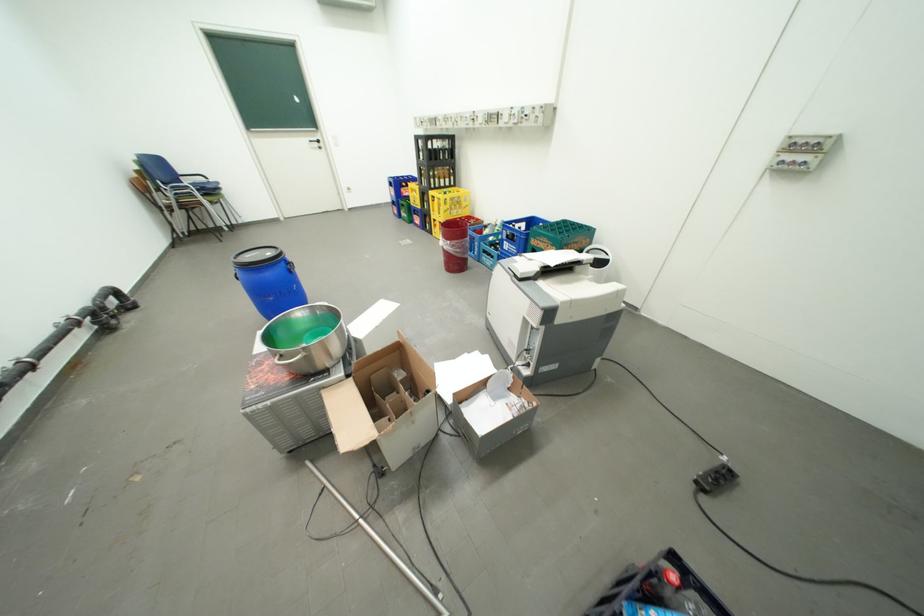
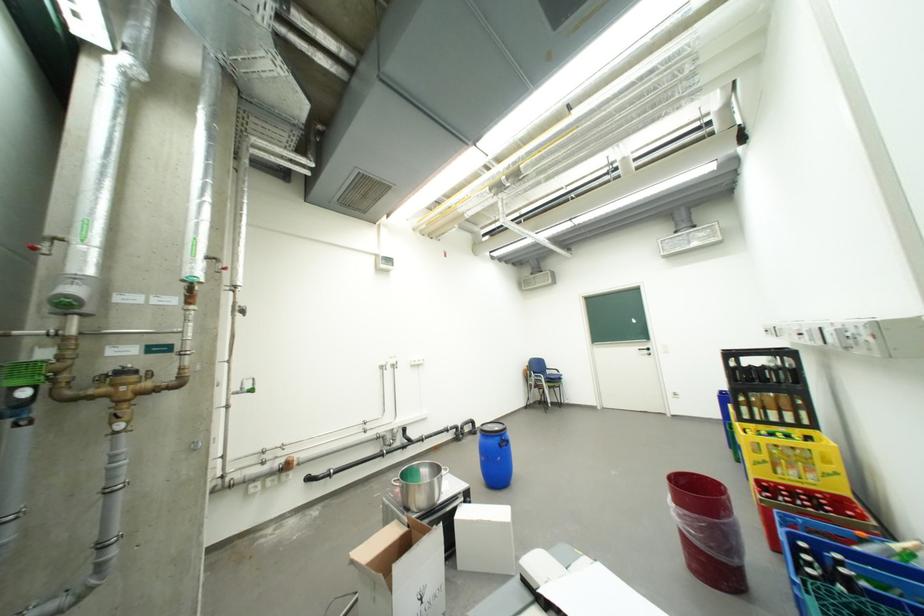
Locate, in the second image, the point that corresponds to point 94,469 in the first image.

(398, 490)